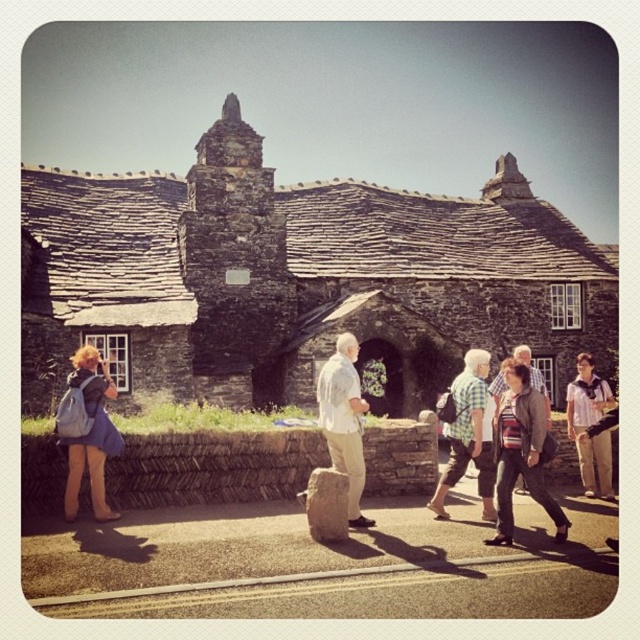
Is white cotton shirt at center further to camera compared to checkered fabric shirt at center?

No, white cotton shirt at center is in front of checkered fabric shirt at center.

Is white cotton shirt at center above checkered fabric shirt at center?

Actually, white cotton shirt at center is below checkered fabric shirt at center.

Who is more forward, (355,490) or (468,397)?

Point (355,490)

Where is `white cotton shirt at center`? This screenshot has width=640, height=640. white cotton shirt at center is located at coordinates (344, 420).

Consider the image. Is checkered fabric shirt at center wider than smooth gray stone at center?

Indeed, checkered fabric shirt at center has a greater width compared to smooth gray stone at center.

Can you confirm if checkered fabric shirt at center is positioned below smooth gray stone at center?

Incorrect, checkered fabric shirt at center is not positioned below smooth gray stone at center.

You are a GUI agent. You are given a task and a screenshot of the screen. Output one action in this format:
    pyautogui.click(x=<x>, y=<y>)
    Task: Click on the checkered fabric shirt at center
    The width and height of the screenshot is (640, 640).
    Given the screenshot: What is the action you would take?
    pyautogui.click(x=468, y=435)

Is striped knit sweater at center to the left of denim jacket at lower left from the viewer's perspective?

In fact, striped knit sweater at center is to the right of denim jacket at lower left.

Is striped knit sweater at center positioned at the back of denim jacket at lower left?

No, it is not.

Who is more distant from viewer, (508, 493) or (99, 429)?

The point (99, 429) is behind.

Image resolution: width=640 pixels, height=640 pixels. Find the location of `striped knit sweater at center`. striped knit sweater at center is located at coordinates (520, 451).